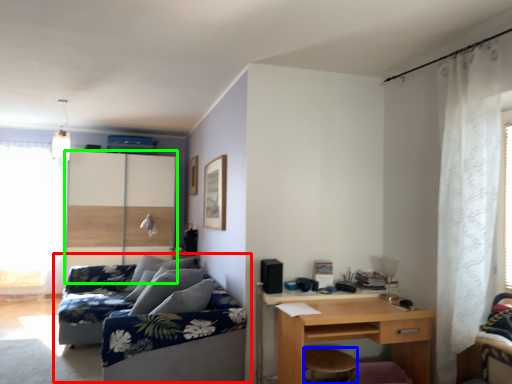
Question: Based on their relative distances, which object is farther from studio couch (highlighted by a red box)? Choose from stool (highlighted by a blue box) and screen door (highlighted by a green box).

Choices:
 (A) stool
 (B) screen door

Answer: (B)